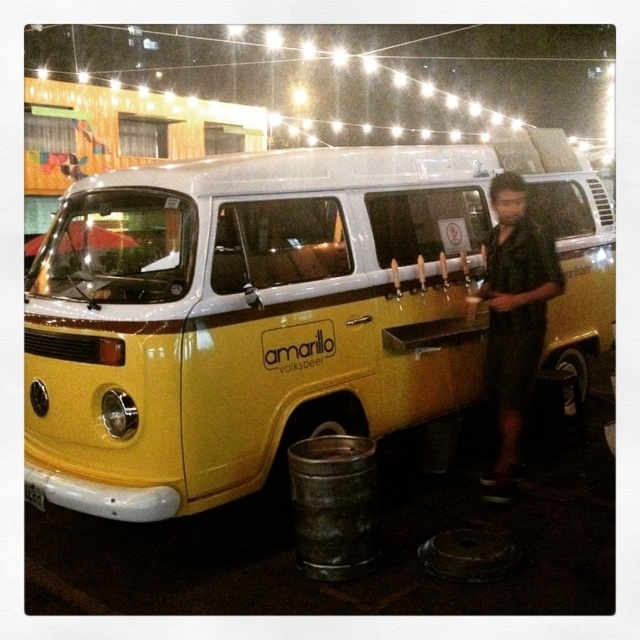
Is yellow matte van at center taller than rusty metal barrel at lower center?

Correct, yellow matte van at center is much taller as rusty metal barrel at lower center.

Is point (227, 476) positioned after point (307, 554)?

Yes.

Identify the location of yellow matte van at center. The height and width of the screenshot is (640, 640). (278, 310).

Who is shorter, yellow matte van at center or dark green shirt at center?

With less height is yellow matte van at center.

Between yellow matte van at center and dark green shirt at center, which one has more height?

Standing taller between the two is dark green shirt at center.

Find the location of a particular element. This screenshot has width=640, height=640. yellow matte van at center is located at coordinates (278, 310).

Can you confirm if dark green shirt at center is smaller than rusty metal barrel at lower center?

Incorrect, dark green shirt at center is not smaller in size than rusty metal barrel at lower center.

Who is positioned more to the right, dark green shirt at center or rusty metal barrel at lower center?

dark green shirt at center is more to the right.

The height and width of the screenshot is (640, 640). In order to click on dark green shirt at center in this screenshot , I will do `click(513, 317)`.